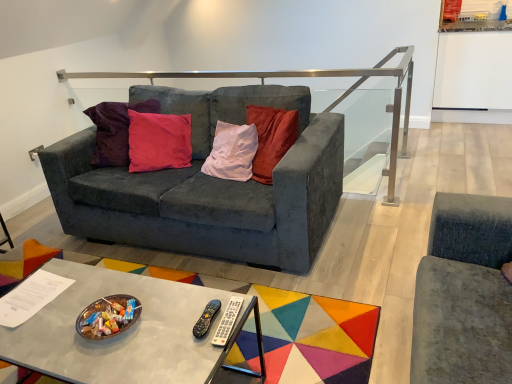
The width and height of the screenshot is (512, 384). I want to click on vacant space behind silver plastic remote at center, the 2th remote when ordered from left to right, so click(x=208, y=294).